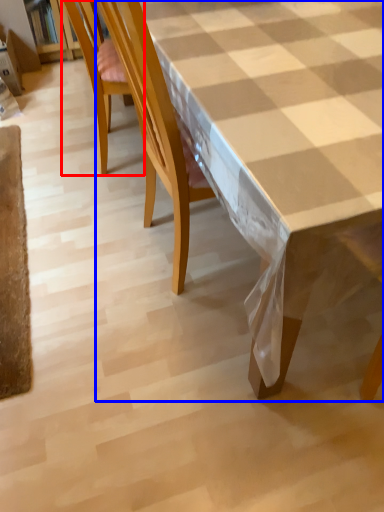
Question: Which object is closer to the camera taking this photo, chair (highlighted by a red box) or table (highlighted by a blue box)?

Choices:
 (A) chair
 (B) table

Answer: (B)